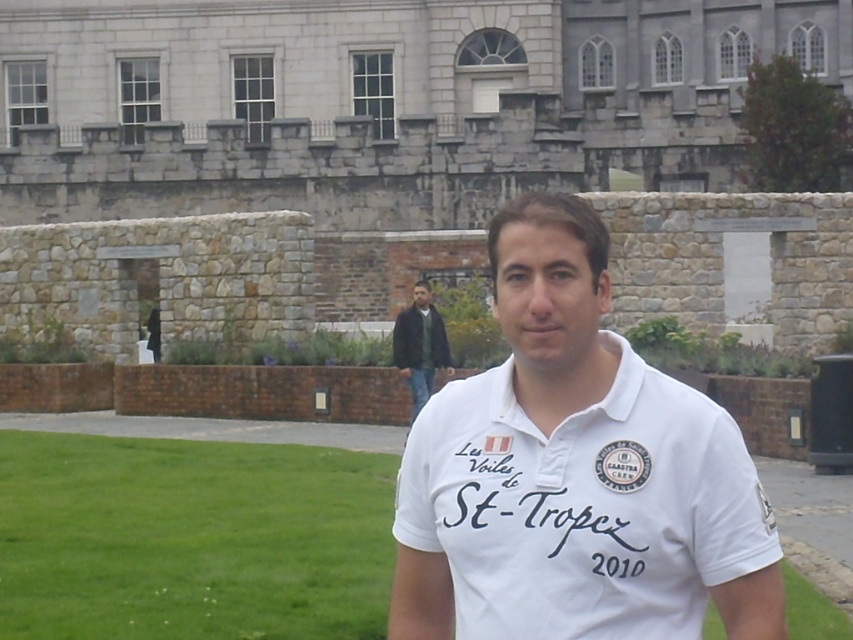
You are a photographer trying to capture a wide shot of the green grass at center and the dark green leather jacket at center. Since you want to include both objects in the frame, which one should you focus on to ensure both are in focus?

You should focus on the green grass at center because it is larger than the dark green leather jacket at center, so focusing on the larger object increases the chances of both being in focus.